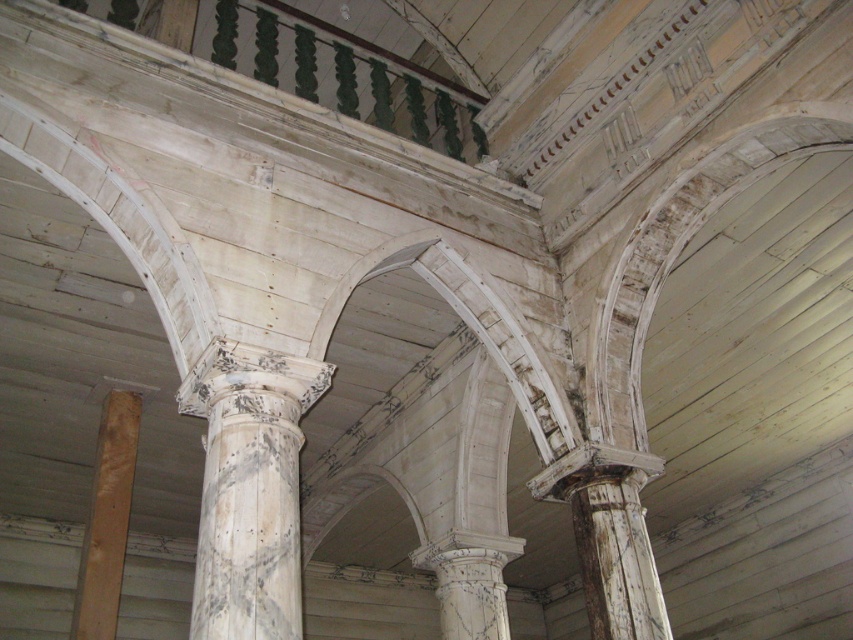
Which is below, white weathered column at center or light brown wood at lower left?

light brown wood at lower left

Is white weathered column at center thinner than light brown wood at lower left?

Indeed, white weathered column at center has a lesser width compared to light brown wood at lower left.

Locate an element on the screen. Image resolution: width=853 pixels, height=640 pixels. white weathered column at center is located at coordinates (248, 488).

Where is `white weathered column at center`? white weathered column at center is located at coordinates (248, 488).